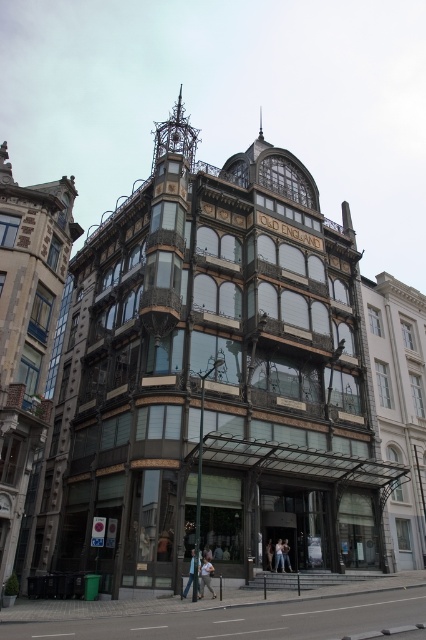
You are standing in front of the ornate Victorian building and see both the light blue jeans at center and the light brown leather jacket at center. Which item is closer to you?

→ The light blue jeans at center is closer to you because it is further to the viewer than the light brown leather jacket at center.

You are an architect analyzing the building facade. You notice the gold metallic clock at upper center and the light brown leather jacket at center. Which object has a greater width?

The gold metallic clock at upper center has a greater width than the light brown leather jacket at center.

You are standing in front of the ornate Victorian building and notice two items near the entrance. Which item is positioned to the left when facing the building? The options are the light blue jeans at lower center and the light brown leather jacket at center.

The light blue jeans at lower center is positioned to the left of the light brown leather jacket at center, so the light blue jeans at lower center is the item on the left.